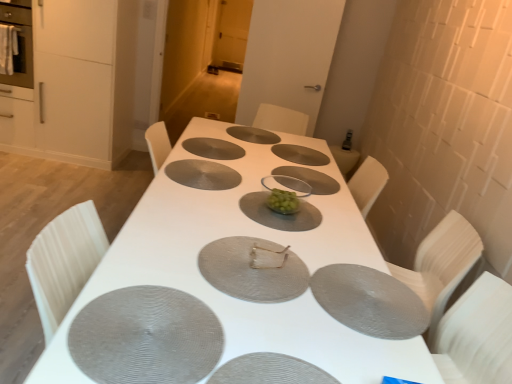
This screenshot has width=512, height=384. In order to click on free spot to the right of gray textured placemat at center, placed as the 7th pizza pan when sorted from back to front in this screenshot , I will do `click(276, 323)`.